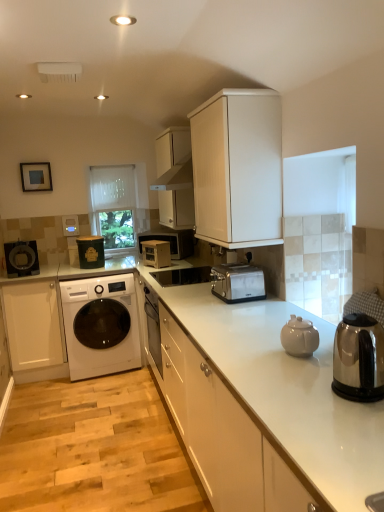
Question: Is matte black coffee maker at left, acting as the 1th appliance starting from the left, to the left or to the right of satin silver sink at center in the image?

Choices:
 (A) right
 (B) left

Answer: (B)

Question: Is point (13, 249) closer or farther from the camera than point (206, 274)?

Choices:
 (A) farther
 (B) closer

Answer: (A)

Question: Considering the real-world distances, which object is closest to the white matte cabinet at upper center, which appears as the third cabinetry when viewed from the right?

Choices:
 (A) matte green container at center-left, the 2th appliance in the left-to-right sequence
 (B) matte black coffee maker at left, acting as the 1th appliance starting from the left
 (C) wooden microwave at center
 (D) white textured cabinet at upper center, arranged as the 2th cabinetry when viewed from the right
 (E) white glossy cabinet at center, placed as the 1th cabinetry when sorted from right to left

Answer: (C)

Question: Estimate the real-world distances between objects in this image. Which object is farther from the white matte cabinet at upper center, marked as the second cabinetry in a left-to-right arrangement?

Choices:
 (A) white matte cabinet at lower left, the 4th cabinetry viewed from the right
 (B) satin silver sink at center
 (C) satin silver toaster at center
 (D) white textured cabinet at upper center, the 3th cabinetry from the left
 (E) white glossy washing machine at left

Answer: (A)